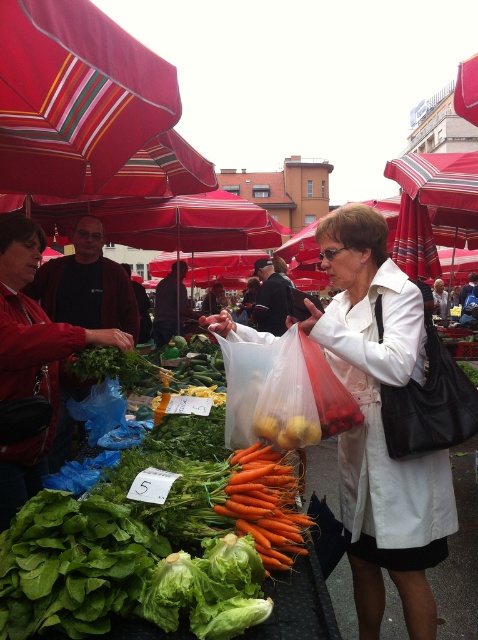
Can you confirm if fresh green leafy vegetables at center is positioned to the right of orange matte carrots at center?

Incorrect, fresh green leafy vegetables at center is not on the right side of orange matte carrots at center.

Does point (196, 474) come behind point (227, 502)?

Yes, it is behind point (227, 502).

What do you see at coordinates (111, 572) in the screenshot?
I see `fresh green leafy vegetables at center` at bounding box center [111, 572].

This screenshot has height=640, width=478. In order to click on fresh green leafy vegetables at center in this screenshot , I will do `click(111, 572)`.

Does white fabric coat at center appear on the left side of orange matte carrots at center?

Incorrect, white fabric coat at center is not on the left side of orange matte carrots at center.

Between point (357, 573) and point (238, 492), which one is positioned in front?

Positioned in front is point (238, 492).

Describe the element at coordinates (380, 422) in the screenshot. This screenshot has width=478, height=640. I see `white fabric coat at center` at that location.

This screenshot has height=640, width=478. What are the coordinates of `white fabric coat at center` in the screenshot? It's located at (380, 422).

Between white fabric coat at center and fresh green leafy vegetables at center, which one appears on the left side from the viewer's perspective?

fresh green leafy vegetables at center

In order to click on white fabric coat at center in this screenshot , I will do `click(380, 422)`.